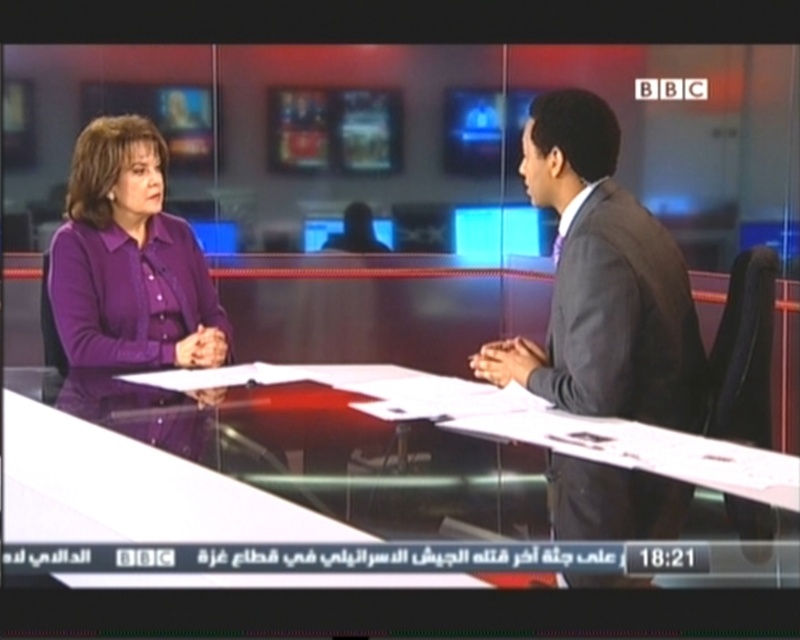
Question: Which point is closer to the camera taking this photo?

Choices:
 (A) (494, 545)
 (B) (74, 148)
 (C) (670, 504)

Answer: (A)

Question: Where is transparent glass table at center located in relation to purple button-down shirt at left in the image?

Choices:
 (A) left
 (B) right

Answer: (B)

Question: Can you confirm if dark gray suit at right is positioned to the right of purple button-down shirt at left?

Choices:
 (A) yes
 (B) no

Answer: (A)

Question: Which point is farther to the camera?

Choices:
 (A) (64, 548)
 (B) (120, 307)
 (C) (564, 403)

Answer: (B)

Question: Does dark gray suit at right come behind purple button-down shirt at left?

Choices:
 (A) no
 (B) yes

Answer: (A)

Question: Which of the following is the closest to the observer?

Choices:
 (A) (680, 305)
 (B) (364, 524)
 (C) (124, 289)

Answer: (B)